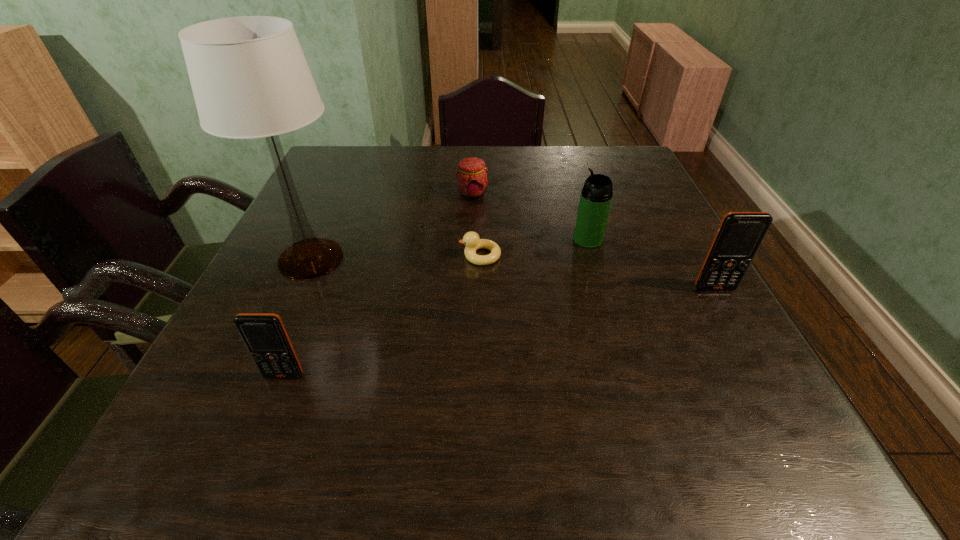
Please point a space for a new cellular_telephone to maintain equal intervals. Please provide its 2D coordinates. Your answer should be formatted as a tuple, i.e. [(x, y)], where the tuple contains the x and y coordinates of a point satisfying the conditions above.

[(519, 328)]